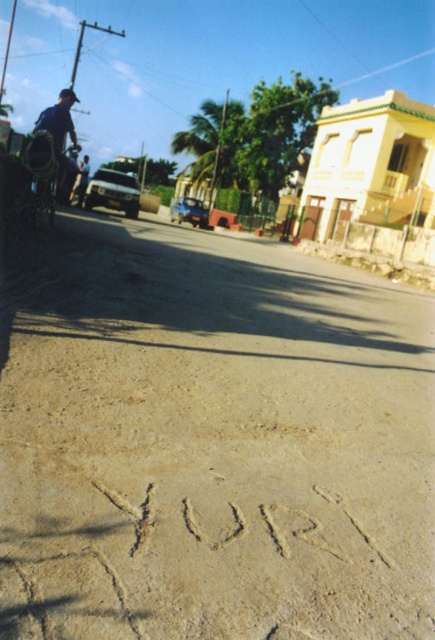
Can you confirm if sand/textured sand at center is taller than dark blue shirt at left?

Incorrect, sand/textured sand at center's height is not larger of dark blue shirt at left's.

Does sand/textured sand at center appear on the left side of dark blue shirt at left?

No, sand/textured sand at center is not to the left of dark blue shirt at left.

Locate an element on the screen. sand/textured sand at center is located at coordinates (297, 531).

Does point (216, 509) lie in front of point (89, 172)?

Yes, it is in front of point (89, 172).

Does brown dirt track at center have a smaller size compared to dark blue shirt at left?

Yes, brown dirt track at center is smaller than dark blue shirt at left.

Between point (23, 442) and point (80, 164), which one is positioned in front?

Point (23, 442)

Image resolution: width=435 pixels, height=640 pixels. Find the location of `brown dirt track at center`. brown dirt track at center is located at coordinates (214, 444).

Can you confirm if blue denim shirt at left is thinner than dark blue shirt at left?

No.

Does blue denim shirt at left have a greater width compared to dark blue shirt at left?

Correct, the width of blue denim shirt at left exceeds that of dark blue shirt at left.

Is point (36, 124) more distant than point (83, 188)?

No, (36, 124) is in front of (83, 188).

Identify the location of blue denim shirt at left. (60, 129).